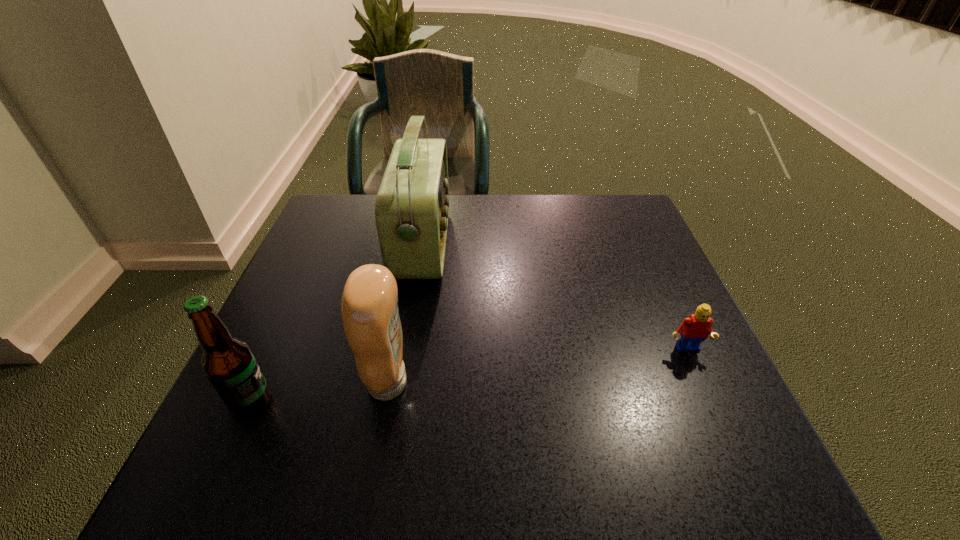
This screenshot has width=960, height=540. Find the location of `object present at the far edge`. object present at the far edge is located at coordinates (412, 204).

Find the location of a particular element. The width and height of the screenshot is (960, 540). object that is at the left edge is located at coordinates click(228, 362).

Locate an element on the screen. This screenshot has width=960, height=540. object that is at the right edge is located at coordinates (695, 329).

Locate an element on the screen. The height and width of the screenshot is (540, 960). vacant space at the far edge of the desktop is located at coordinates (469, 198).

You are a GUI agent. You are given a task and a screenshot of the screen. Output one action in this format:
    pyautogui.click(x=<x>, y=<y>)
    Task: Click on the free space at the near edge
    
    Given the screenshot: What is the action you would take?
    pyautogui.click(x=343, y=453)

In the image, there is a desktop. In order to click on vacant space at the left edge in this screenshot , I will do `click(283, 424)`.

The width and height of the screenshot is (960, 540). I want to click on vacant space at the right edge of the desktop, so click(x=670, y=352).

Where is `vacant space at the far left corner of the desktop`? This screenshot has height=540, width=960. vacant space at the far left corner of the desktop is located at coordinates (343, 197).

Locate an element on the screen. free region at the near left corner of the desktop is located at coordinates tap(239, 495).

Identify the location of free spot between the condiment and the shortest object. (538, 367).